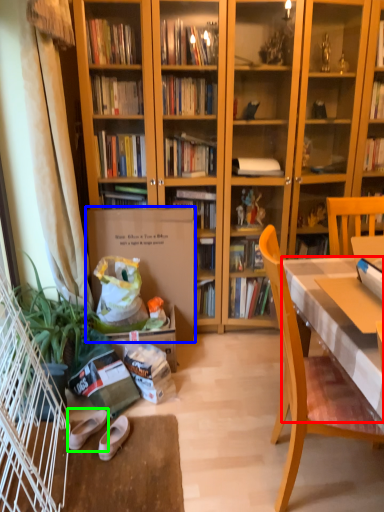
Question: Which object is positioned farthest from desk (highlighted by a red box)? Select from paperback book (highlighted by a blue box) and footwear (highlighted by a green box).

Choices:
 (A) paperback book
 (B) footwear

Answer: (B)